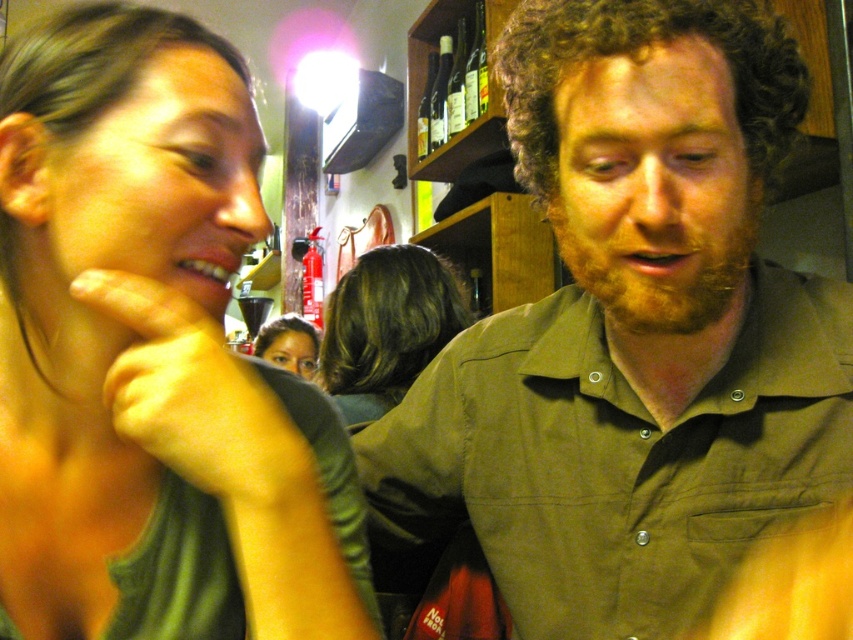
Question: Based on their relative distances, which object is farther from the blonde hair at center?

Choices:
 (A) clear glass bottles at upper center
 (B) green matte shirt at upper left
 (C) green cotton shirt at center
 (D) smooth skin face at center

Answer: (D)

Question: Which of the following is the closest to the observer?

Choices:
 (A) (819, 291)
 (B) (421, 132)
 (C) (289, 348)

Answer: (A)

Question: Among these objects, which one is farthest from the camera?

Choices:
 (A) green cotton shirt at center
 (B) green matte shirt at upper left
 (C) matte skin hand at left

Answer: (A)

Question: Is green matte shirt at upper left wider than matte skin hand at left?

Choices:
 (A) yes
 (B) no

Answer: (A)

Question: Does green cotton shirt at center have a greater width compared to blonde hair at center?

Choices:
 (A) yes
 (B) no

Answer: (A)

Question: In this image, where is blonde hair at center located relative to clear glass bottles at upper center?

Choices:
 (A) left
 (B) right

Answer: (A)